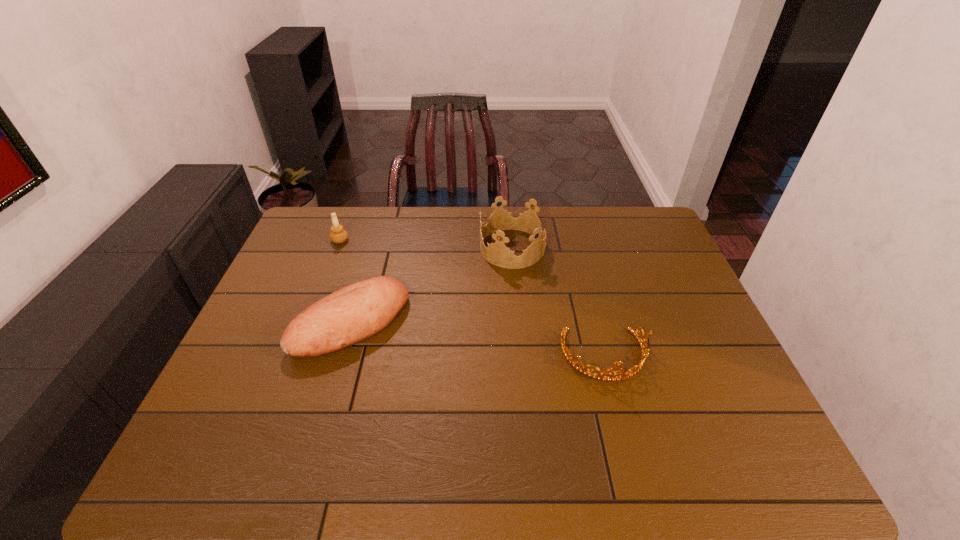
The height and width of the screenshot is (540, 960). Find the location of `vacant space located 0.060m on the front-facing side of the nearer tiara`. vacant space located 0.060m on the front-facing side of the nearer tiara is located at coordinates (618, 408).

Locate an element on the screen. tiara present at the far edge is located at coordinates (497, 253).

Find the location of a particular element. Image resolution: width=960 pixels, height=540 pixels. candle_holder located in the far edge section of the desktop is located at coordinates (338, 235).

This screenshot has width=960, height=540. I want to click on candle_holder at the left edge, so click(338, 235).

Locate an element on the screen. bread that is positioned at the left edge is located at coordinates (354, 313).

Find the location of a particular element. The height and width of the screenshot is (540, 960). object that is at the far left corner is located at coordinates (338, 235).

In the image, there is a desktop. Where is `vacant region at the far edge`? The width and height of the screenshot is (960, 540). vacant region at the far edge is located at coordinates (608, 242).

In the image, there is a desktop. Where is `vacant region at the left edge`? This screenshot has height=540, width=960. vacant region at the left edge is located at coordinates (240, 371).

Identify the location of vacant space at the right edge of the desktop. The height and width of the screenshot is (540, 960). (684, 344).

This screenshot has height=540, width=960. In the image, there is a desktop. Find the location of `vacant region at the far left corner`. vacant region at the far left corner is located at coordinates (x=319, y=219).